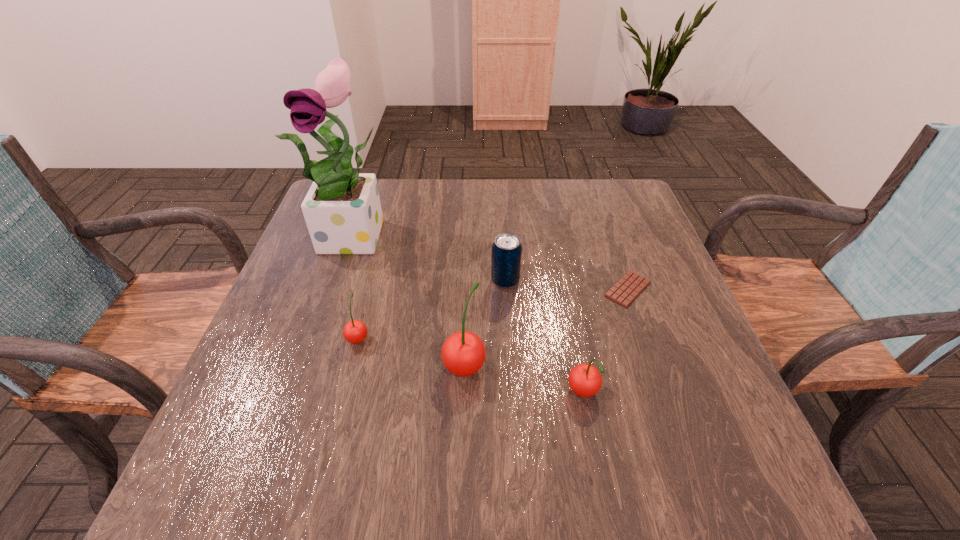
You are a GUI agent. You are given a task and a screenshot of the screen. Output one action in this format:
    pyautogui.click(x=<x>, y=<y>)
    Task: Click on the object at the right edge
    
    Given the screenshot: What is the action you would take?
    pyautogui.click(x=624, y=292)

In order to click on object situated at the far left corner in this screenshot , I will do `click(342, 209)`.

I want to click on vacant region at the far edge of the desktop, so pyautogui.click(x=421, y=217).

Where is `free region at the left edge of the desktop`? This screenshot has width=960, height=540. free region at the left edge of the desktop is located at coordinates (326, 267).

Locate an element on the screen. The width and height of the screenshot is (960, 540). vacant space at the right edge is located at coordinates (x=674, y=383).

Locate an element on the screen. vacant space at the far right corner of the desktop is located at coordinates (601, 204).

You are a GUI agent. You are given a task and a screenshot of the screen. Output one action in this format:
    pyautogui.click(x=<x>, y=<y>)
    Task: Click on the free location at the near right corner of the desktop
    Image resolution: width=960 pixels, height=540 pixels.
    Given the screenshot: What is the action you would take?
    pyautogui.click(x=648, y=395)

Locate an element on the screen. vacant space in between the third object from right to left and the shortest cherry is located at coordinates (432, 309).

Image resolution: width=960 pixels, height=540 pixels. Identify the location of vacant area between the leftmost cherry and the tallest object. (358, 286).

I want to click on free spot between the second tallest cherry and the tallest object, so click(x=470, y=315).